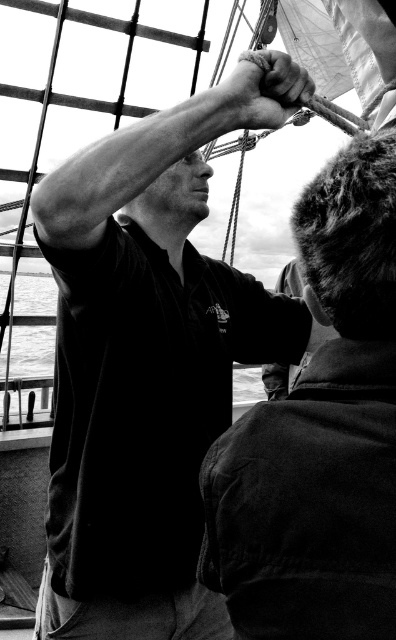
In the scene shown: Is smooth black shirt at center above smooth metal hand at center?

No.

Between smooth black shirt at center and smooth metal hand at center, which one is positioned higher?

smooth metal hand at center is above.

Locate an element on the screen. This screenshot has width=396, height=640. smooth black shirt at center is located at coordinates (142, 374).

Does smooth black shirt at center come behind dark fabric jacket at center?

That is True.

How distant is smooth black shirt at center from dark fabric jacket at center?

smooth black shirt at center and dark fabric jacket at center are 7.16 feet apart.

Is point (148, 148) more distant than point (316, 189)?

Yes, point (148, 148) is behind point (316, 189).

Identify the location of smooth black shirt at center. Image resolution: width=396 pixels, height=640 pixels. (142, 374).

Between point (255, 440) and point (308, 93), which one is positioned behind?

The point (308, 93) is behind.

Looking at this image, is dark fabric jacket at center taller than smooth metal hand at center?

Yes, dark fabric jacket at center is taller than smooth metal hand at center.

Between point (249, 412) and point (289, 100), which one is positioned behind?

Point (289, 100)

Find the location of a particular element. Image resolution: width=396 pixels, height=640 pixels. dark fabric jacket at center is located at coordinates (319, 435).